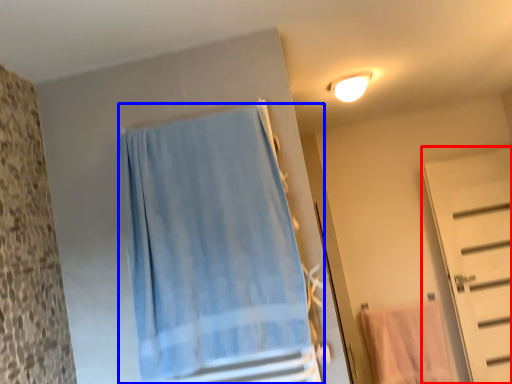
Question: Which object is further to the camera taking this photo, door (highlighted by a red box) or curtain (highlighted by a blue box)?

Choices:
 (A) door
 (B) curtain

Answer: (A)